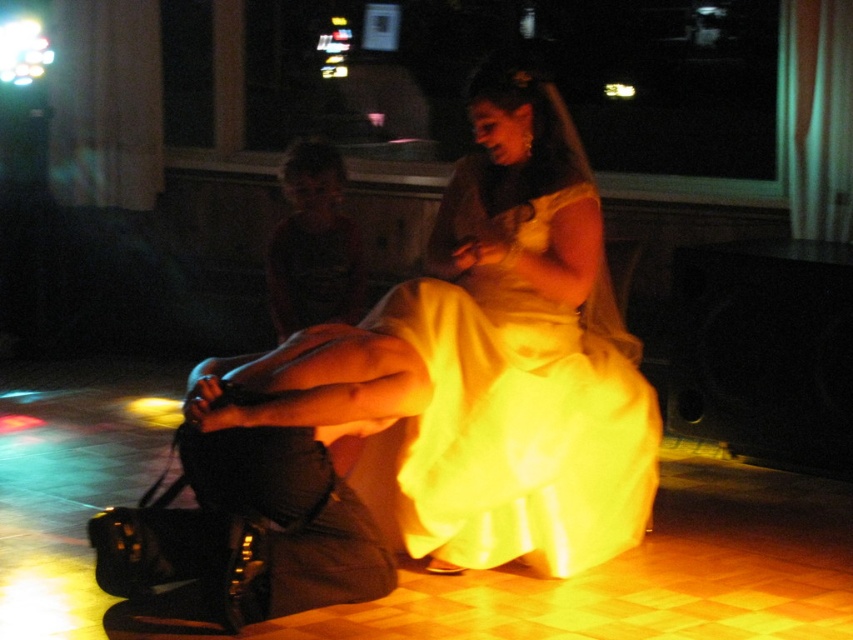
Between silky yellow dress at center and black leather purse at lower left, which one has less height?

With less height is black leather purse at lower left.

Is silky yellow dress at center to the left of black leather purse at lower left from the viewer's perspective?

In fact, silky yellow dress at center is to the right of black leather purse at lower left.

Which is in front, point (508, 531) or point (165, 573)?

Point (165, 573) is in front.

You are a GUI agent. You are given a task and a screenshot of the screen. Output one action in this format:
    pyautogui.click(x=<x>, y=<y>)
    Task: Click on the silky yellow dress at center
    This screenshot has width=853, height=640.
    Given the screenshot: What is the action you would take?
    pyautogui.click(x=514, y=428)